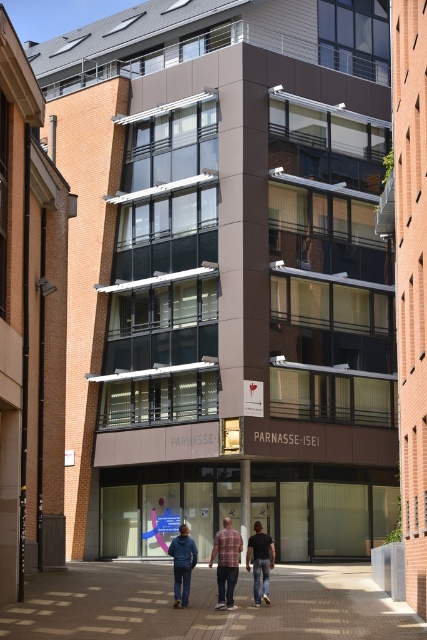
You are standing 20 meters away from the entrance of Parnasse building and want to reach the brown brick pavement at lower center. Can you walk straight ahead to reach it?

The brown brick pavement at lower center is 25.53 meters away from the viewer. Since you are already 20 meters away from the entrance, you need to check the distance between the entrance and the pavement. If the entrance is closer than 5.53 meters to the pavement, then walking straight might work. However, without knowing the exact layout, it is uncertain. But according to the given data, the pavement is 25.53 meters from your current position, so walking straight may require covering that distance.

Looking at this image, you are an architect reviewing a design blueprint and notice a point labeled at coordinates (225, 563). According to the scene description, what object is located at that point?

The point at coordinates (225, 563) indicates the plaid fabric shirt at center.

You are standing in front of the building and see the point marked at coordinates (227, 563). What object is located at that point?

The point at coordinates (227, 563) marks denim pants at center.